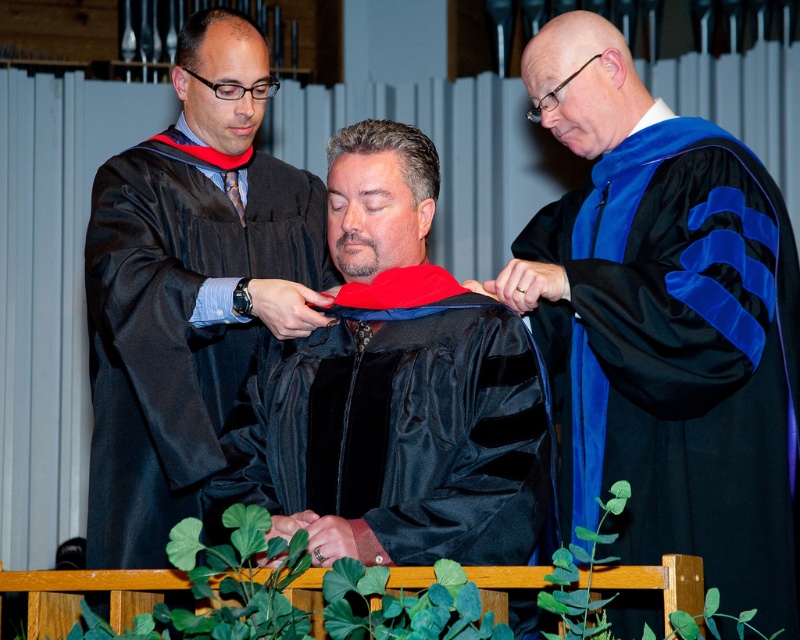
Which is below, black satin graduation gown at center or matte black graduation gown at left?

black satin graduation gown at center is lower down.

Can you confirm if black satin graduation gown at center is positioned to the left of matte black graduation gown at left?

Incorrect, black satin graduation gown at center is not on the left side of matte black graduation gown at left.

At what (x,y) coordinates should I click in order to perform the action: click on black satin graduation gown at center. Please return your answer as a coordinate pair (x, y). The image size is (800, 640). Looking at the image, I should click on (664, 324).

Image resolution: width=800 pixels, height=640 pixels. Identify the location of black satin graduation gown at center. (664, 324).